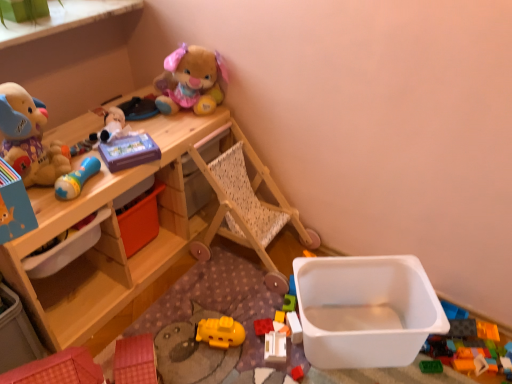
Question: From the image's perspective, is purple matte tissue box at upper center, marked as the seventh toy in a bottom-to-top arrangement, positioned above or below fluffy plush rabbit at upper center, which ranks as the 9th toy in bottom-to-top order?

Choices:
 (A) below
 (B) above

Answer: (A)

Question: From a real-world perspective, is purple matte tissue box at upper center, which is the third toy from top to bottom, physically located above or below fluffy plush rabbit at upper center, the 1th toy viewed from the top?

Choices:
 (A) below
 (B) above

Answer: (A)

Question: Which is farther from the fluffy plush rabbit at upper center, the 1th toy viewed from the top?

Choices:
 (A) soft plush toy at left, which appears as the second toy when viewed from the top
 (B) yellow plastic toy at center, the 5th toy when ordered from top to bottom
 (C) white plastic container at lower right, which is the 2th storage box from left to right
 (D) purple matte tissue box at upper center, marked as the seventh toy in a bottom-to-top arrangement
 (E) white plastic toy at center, the 1th toy from the bottom

Answer: (E)

Question: Considering the real-world distances, which object is closest to the purple matte tissue box at upper center, marked as the seventh toy in a bottom-to-top arrangement?

Choices:
 (A) soft plush toy at left, placed as the eighth toy when sorted from bottom to top
 (B) white plastic container at lower right, which is the 2th storage box in top-to-bottom order
 (C) translucent plastic blocks at center, the 3th toy when ordered from bottom to top
 (D) blue rubber rattle at upper left, the fourth toy positioned from the top
 (E) fluffy plush rabbit at upper center, the 1th toy viewed from the top

Answer: (D)